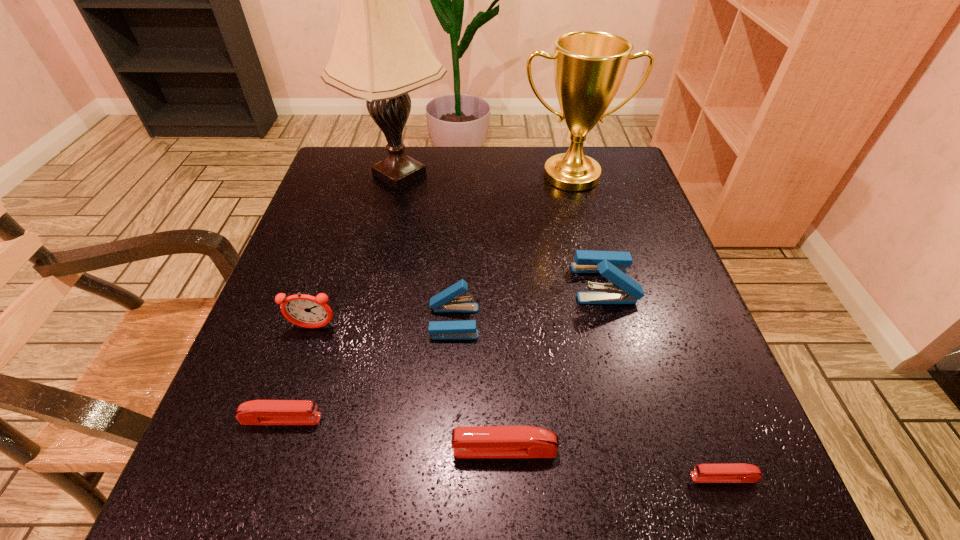
Find the location of a particular element. free space at the far left corner is located at coordinates (381, 186).

Where is `vacant space at the far right corner`? This screenshot has width=960, height=540. vacant space at the far right corner is located at coordinates (623, 155).

Identify the location of free space between the third nearest stapler and the right blue stapler. This screenshot has width=960, height=540. (443, 351).

You are a GUI agent. You are given a task and a screenshot of the screen. Output one action in this format:
    pyautogui.click(x=<x>, y=<y>)
    Task: Click on the vacant space in between the tallest object and the reddish-pink alarm clock
    The height and width of the screenshot is (540, 960).
    Given the screenshot: What is the action you would take?
    pyautogui.click(x=356, y=251)

In order to click on vacant point located between the third tallest stapler and the farthest stapler in this screenshot , I will do `click(555, 367)`.

The image size is (960, 540). What are the coordinates of `vacant point located between the award and the nearest red stapler` in the screenshot? It's located at (647, 327).

Identify the location of blank region between the third farthest object and the beige lamp. The image size is (960, 540). (502, 229).

This screenshot has width=960, height=540. Identify the location of free space between the left blue stapler and the gold award. (513, 249).

Locate an element on the screen. This screenshot has width=960, height=540. vacant area that lies between the nearest object and the biggest red stapler is located at coordinates (614, 463).

The width and height of the screenshot is (960, 540). Identify the location of empty space that is in between the third nearest object and the seventh shortest object. (426, 298).